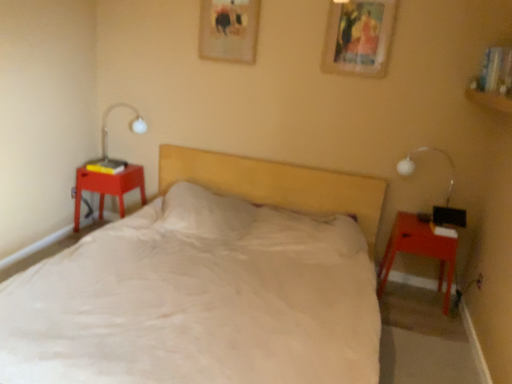
Question: From the image's perspective, is white glossy table lamp at left beneath white glass bedside lamp at right?

Choices:
 (A) no
 (B) yes

Answer: (A)

Question: Is white glossy table lamp at left smaller than white glass bedside lamp at right?

Choices:
 (A) yes
 (B) no

Answer: (B)

Question: From a real-world perspective, does white glossy table lamp at left stand above white glass bedside lamp at right?

Choices:
 (A) yes
 (B) no

Answer: (A)

Question: Would you say white glossy table lamp at left is a long distance from white glass bedside lamp at right?

Choices:
 (A) yes
 (B) no

Answer: (A)

Question: Is white glossy table lamp at left to the right of white glass bedside lamp at right from the viewer's perspective?

Choices:
 (A) yes
 (B) no

Answer: (B)

Question: Does white glossy table lamp at left have a lesser width compared to white glass bedside lamp at right?

Choices:
 (A) yes
 (B) no

Answer: (B)

Question: Is matte plastic nightstand at left, which ranks as the first nightstand in left-to-right order, inside white glossy table lamp at left?

Choices:
 (A) yes
 (B) no

Answer: (B)

Question: Does white glossy table lamp at left appear on the right side of matte plastic nightstand at left, the 2th nightstand when ordered from right to left?

Choices:
 (A) no
 (B) yes

Answer: (B)

Question: Does white glossy table lamp at left have a larger size compared to matte plastic nightstand at left, the 2th nightstand when ordered from right to left?

Choices:
 (A) no
 (B) yes

Answer: (A)

Question: Does white glossy table lamp at left have a greater height compared to matte plastic nightstand at left, which is the second nightstand from front to back?

Choices:
 (A) yes
 (B) no

Answer: (B)

Question: Is white glossy table lamp at left oriented towards matte plastic nightstand at left, the 2th nightstand when ordered from right to left?

Choices:
 (A) yes
 (B) no

Answer: (B)

Question: From a real-world perspective, does white glossy table lamp at left stand above matte plastic nightstand at left, the 2th nightstand when ordered from right to left?

Choices:
 (A) no
 (B) yes

Answer: (B)

Question: Can you confirm if white glass bedside lamp at right is positioned to the left of matte red nightstand at right, the first nightstand when ordered from right to left?

Choices:
 (A) yes
 (B) no

Answer: (B)